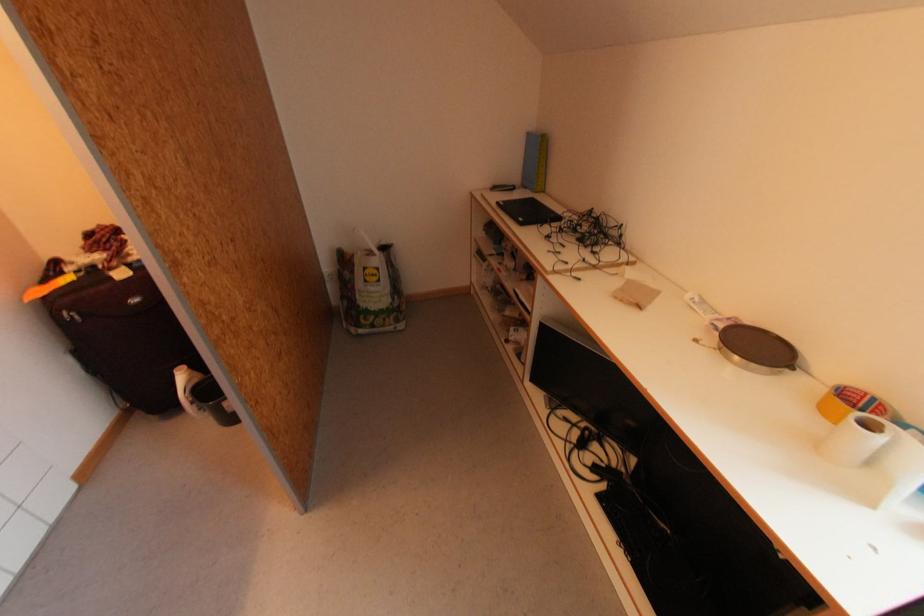
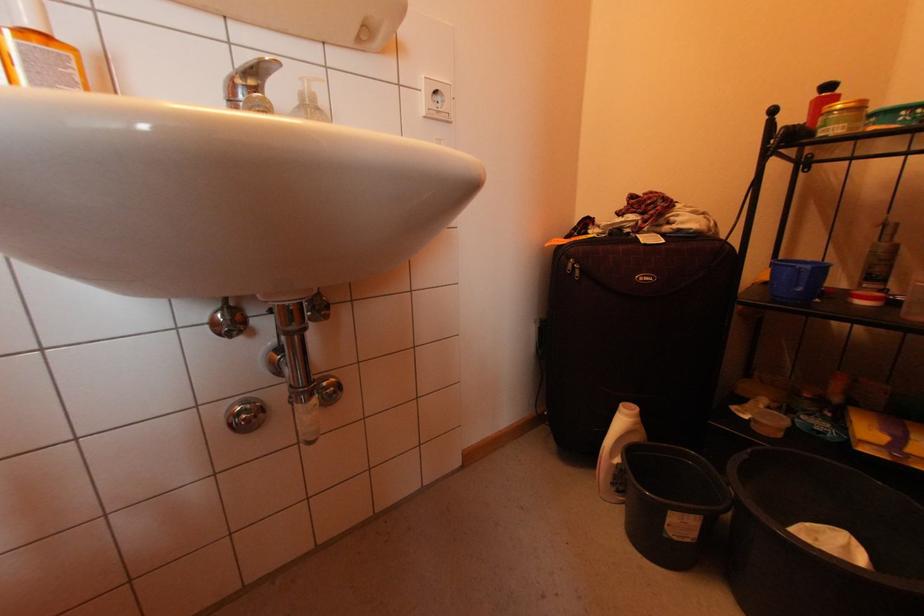
Find the pixel in the second image that matches point (195, 374) in the first image.

(640, 424)